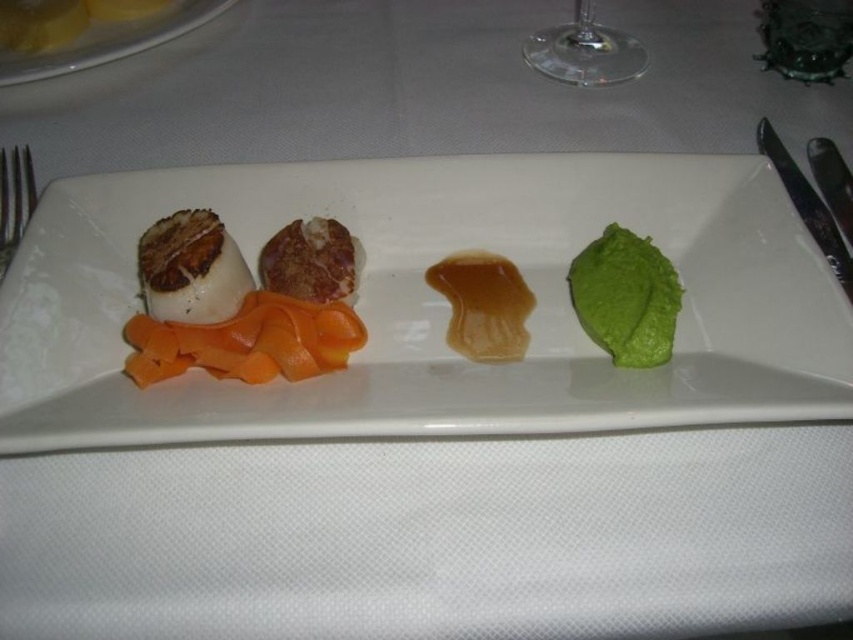
Question: Which is nearer to the silvermetallicutensil at right?

Choices:
 (A) matte white plate at center
 (B) silver metallic fork at left
 (C) transparent glass wine glass at upper center
 (D) brown crispy meat at center

Answer: (A)

Question: Which point is farther to the camera?

Choices:
 (A) (1, 272)
 (B) (846, 301)

Answer: (A)

Question: Which point is farther to the camera?

Choices:
 (A) (611, 35)
 (B) (180, 298)
 (C) (115, 180)
 (D) (4, 60)

Answer: (A)

Question: Does brown seared scallop at left have a greater width compared to brown crispy meat at center?

Choices:
 (A) no
 (B) yes

Answer: (B)

Question: Can you confirm if orange smooth carrot at left is positioned to the right of silvermetallicutensil at right?

Choices:
 (A) no
 (B) yes

Answer: (A)

Question: Is orange smooth carrot at left behind brown seared scallop at left?

Choices:
 (A) no
 (B) yes

Answer: (A)